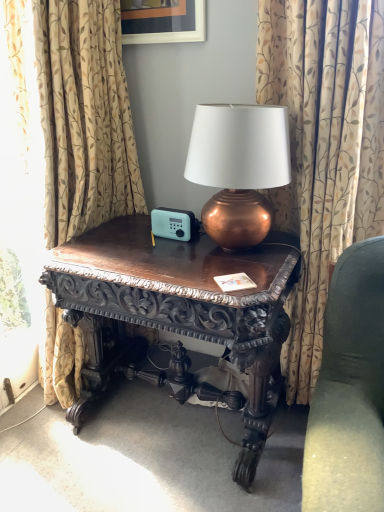
Question: Is matte black picture frame at upper center directly adjacent to dark wood carved table at center?

Choices:
 (A) no
 (B) yes

Answer: (A)

Question: Is matte black picture frame at upper center looking in the opposite direction of dark wood carved table at center?

Choices:
 (A) no
 (B) yes

Answer: (A)

Question: Could you tell me if matte black picture frame at upper center is facing dark wood carved table at center?

Choices:
 (A) no
 (B) yes

Answer: (A)

Question: Is matte black picture frame at upper center positioned before dark wood carved table at center?

Choices:
 (A) no
 (B) yes

Answer: (A)

Question: Is dark wood carved table at center inside matte black picture frame at upper center?

Choices:
 (A) no
 (B) yes

Answer: (A)

Question: From the image's perspective, does matte black picture frame at upper center appear higher than dark wood carved table at center?

Choices:
 (A) no
 (B) yes

Answer: (B)

Question: Does copper metallic lamp at center come in front of velvet green couch at right?

Choices:
 (A) yes
 (B) no

Answer: (B)

Question: Would you say copper metallic lamp at center is outside velvet green couch at right?

Choices:
 (A) no
 (B) yes

Answer: (B)

Question: Considering the relative positions of copper metallic lamp at center and velvet green couch at right in the image provided, is copper metallic lamp at center to the left of velvet green couch at right from the viewer's perspective?

Choices:
 (A) yes
 (B) no

Answer: (A)

Question: Can you confirm if copper metallic lamp at center is bigger than velvet green couch at right?

Choices:
 (A) yes
 (B) no

Answer: (B)

Question: From the image's perspective, does copper metallic lamp at center appear higher than velvet green couch at right?

Choices:
 (A) no
 (B) yes

Answer: (B)

Question: Is copper metallic lamp at center shorter than velvet green couch at right?

Choices:
 (A) yes
 (B) no

Answer: (A)

Question: Is dark wood carved table at center oriented towards patterned fabric curtain at center, the second curtain when ordered from left to right?

Choices:
 (A) yes
 (B) no

Answer: (B)